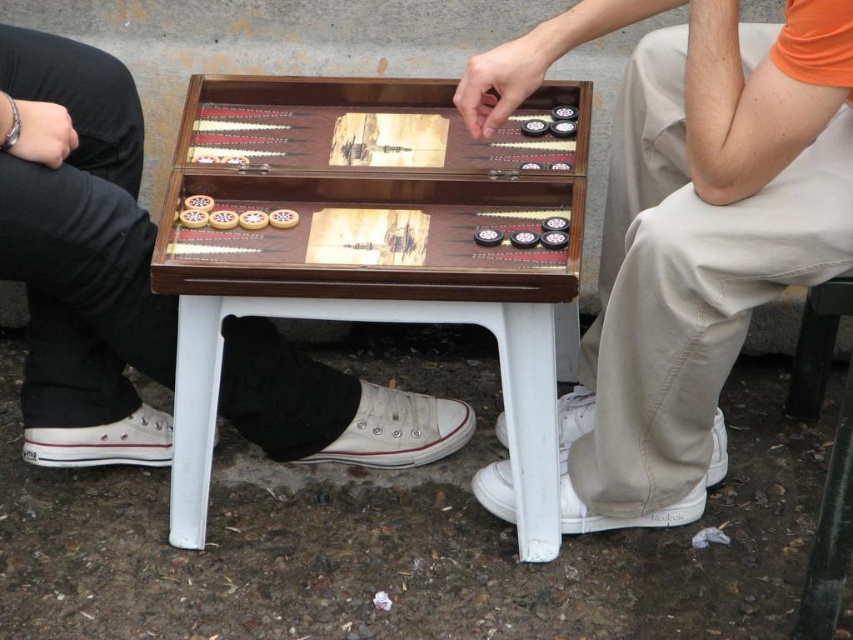
Between point (625, 445) and point (849, 374), which one is positioned in front?

Point (849, 374) is more forward.

Is matte wooden backgammon board at center to the right of black metal stool at lower right from the viewer's perspective?

Incorrect, matte wooden backgammon board at center is not on the right side of black metal stool at lower right.

Is point (572, 8) positioned in front of point (808, 301)?

Yes, it is.

You are a GUI agent. You are given a task and a screenshot of the screen. Output one action in this format:
    pyautogui.click(x=<x>, y=<y>)
    Task: Click on the matte wooden backgammon board at center
    
    Given the screenshot: What is the action you would take?
    pyautogui.click(x=703, y=244)

Can you confirm if wooden backgammon board at center is shorter than wooden backgammon set at center?

No, wooden backgammon board at center is not shorter than wooden backgammon set at center.

Is point (515, 256) farther from camera compared to point (483, 220)?

That is False.

Is point (195, 250) farther from viewer compared to point (416, 196)?

No, (195, 250) is closer to viewer.

The width and height of the screenshot is (853, 640). Find the location of `wooden backgammon board at center`. wooden backgammon board at center is located at coordinates (372, 253).

Who is more forward, (393, 218) or (824, 524)?

Point (824, 524)

Is point (578, 209) behind point (828, 518)?

Yes, it is.

What are the coordinates of `wooden backgammon board at center` in the screenshot? It's located at (372, 253).